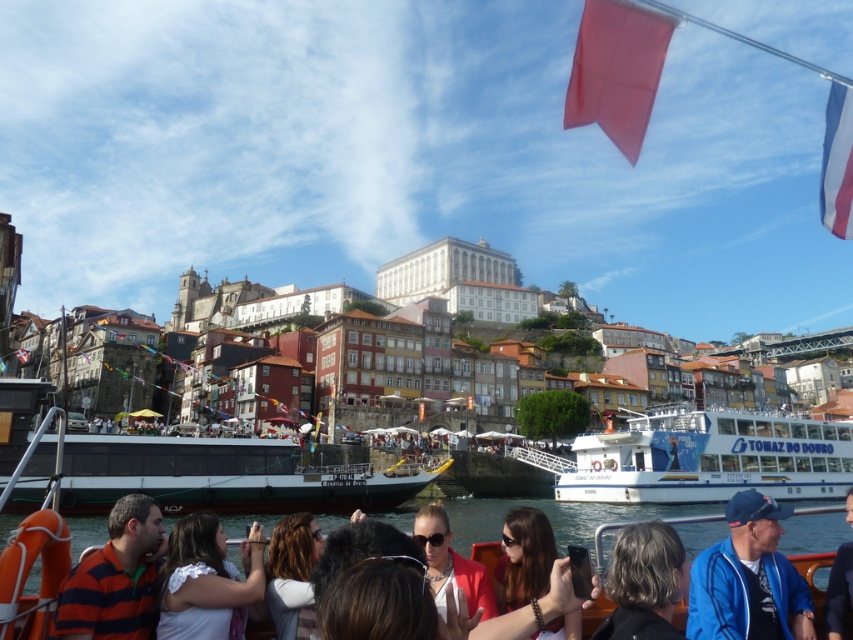
You are standing on the riverside and notice two blue fabric items at the lower right of the scene. Which one is closer to you, the blue fabric jacket at lower right or the blue fabric shirt at lower right?

The blue fabric jacket at lower right is 4.19 meters away from the blue fabric shirt at lower right, so the jacket is farther away from the shirt. Since both are at the lower right, the shirt is closer to you because it is between you and the jacket.

You are standing on the riverside and want to take a photo of both the point at (611, 97) and the point at (834, 572). Based on their positions, which point will appear closer to the camera in your photo?

Point at (611, 97) will appear closer to the camera in the photo because it is further to the camera than point at (834, 572).

You are standing on the riverside and see the white glossy boat at lower right and the red fabric flag at upper center. Which object is positioned more to the east if the river flows from west to east?

The white glossy boat at lower right is positioned more to the east than the red fabric flag at upper center because it is to the right of the flag, and since the river flows from west to east, the right side of the image corresponds to the eastern direction.